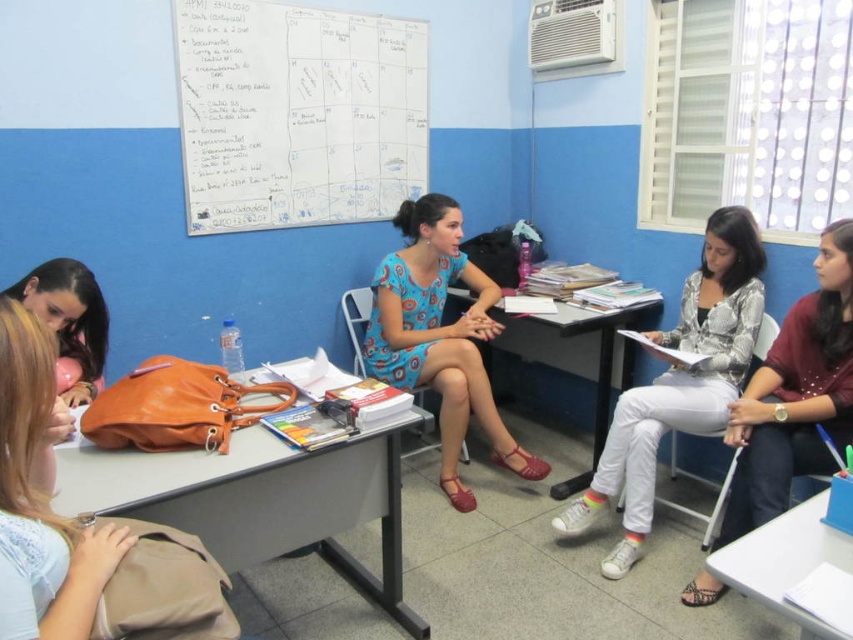
What object is located at the coordinates point (297, 113) in the classroom scene?

The point (297, 113) is located on the whiteboard at upper center.

You are a student entering the classroom and need to locate both the whiteboard at upper center and the matte beige backpack at lower left. Which object is larger in size?

The whiteboard at upper center is bigger than the matte beige backpack at lower left.